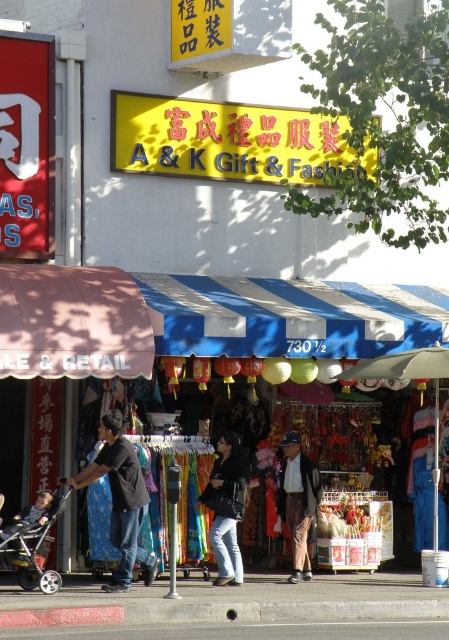
Measure the distance from black matte shirt at center to denim jacket at center.

1.04 meters

Is point (114, 531) more distant than point (232, 474)?

No, it is not.

At what (x,y) coordinates should I click in order to perform the action: click on black matte shirt at center. Please return your answer as a coordinate pair (x, y). The width and height of the screenshot is (449, 640). Looking at the image, I should click on (120, 500).

Is yellow matte sign at upper center bigger than denim jacket at center?

Indeed, yellow matte sign at upper center has a larger size compared to denim jacket at center.

Locate an element on the screen. yellow matte sign at upper center is located at coordinates (x=224, y=140).

Who is positioned more to the left, black matte shirt at center or metallic silver stroller at lower left?

From the viewer's perspective, metallic silver stroller at lower left appears more on the left side.

Between black matte shirt at center and metallic silver stroller at lower left, which one has less height?

With less height is metallic silver stroller at lower left.

Which is behind, point (67, 481) or point (40, 508)?

The point (67, 481) is behind.

You are a GUI agent. You are given a task and a screenshot of the screen. Output one action in this format:
    pyautogui.click(x=<x>, y=<y>)
    Task: Click on the black matte shirt at center
    The image size is (449, 640).
    Given the screenshot: What is the action you would take?
    pyautogui.click(x=120, y=500)